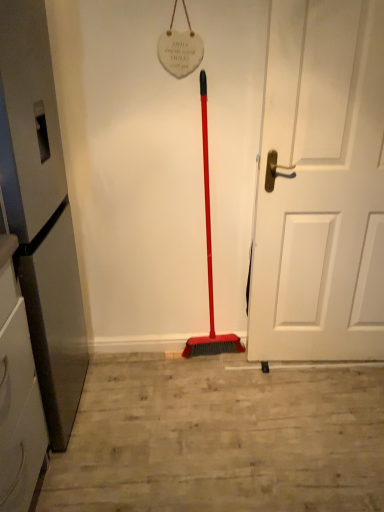
Question: In the image, is metallic gray refrigerator at left positioned in front of or behind white matte door at center?

Choices:
 (A) front
 (B) behind

Answer: (A)

Question: Choose the correct answer: Is metallic gray refrigerator at left inside white matte door at center or outside it?

Choices:
 (A) inside
 (B) outside

Answer: (B)

Question: Looking at the image, does metallic gray refrigerator at left seem bigger or smaller compared to white matte door at center?

Choices:
 (A) small
 (B) big

Answer: (B)

Question: In terms of size, does white matte door at center appear bigger or smaller than metallic gray refrigerator at left?

Choices:
 (A) big
 (B) small

Answer: (B)

Question: Is white matte door at center wider or thinner than metallic gray refrigerator at left?

Choices:
 (A) thin
 (B) wide

Answer: (A)

Question: Is point (377, 220) closer or farther from the camera than point (41, 298)?

Choices:
 (A) closer
 (B) farther

Answer: (B)

Question: In the image, is white matte door at center on the left side or the right side of metallic gray refrigerator at left?

Choices:
 (A) left
 (B) right

Answer: (B)